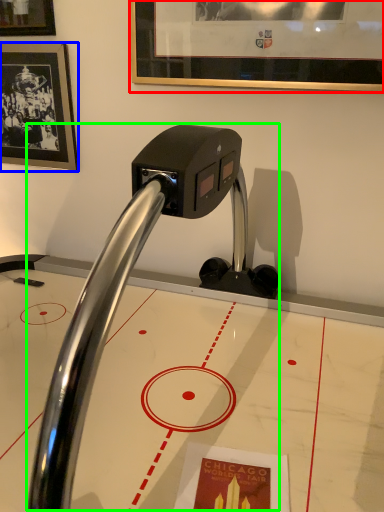
Question: Considering the real-world distances, which object is farthest from picture frame (highlighted by a red box)? picture frame (highlighted by a blue box) or faucet (highlighted by a green box)?

Choices:
 (A) picture frame
 (B) faucet

Answer: (B)